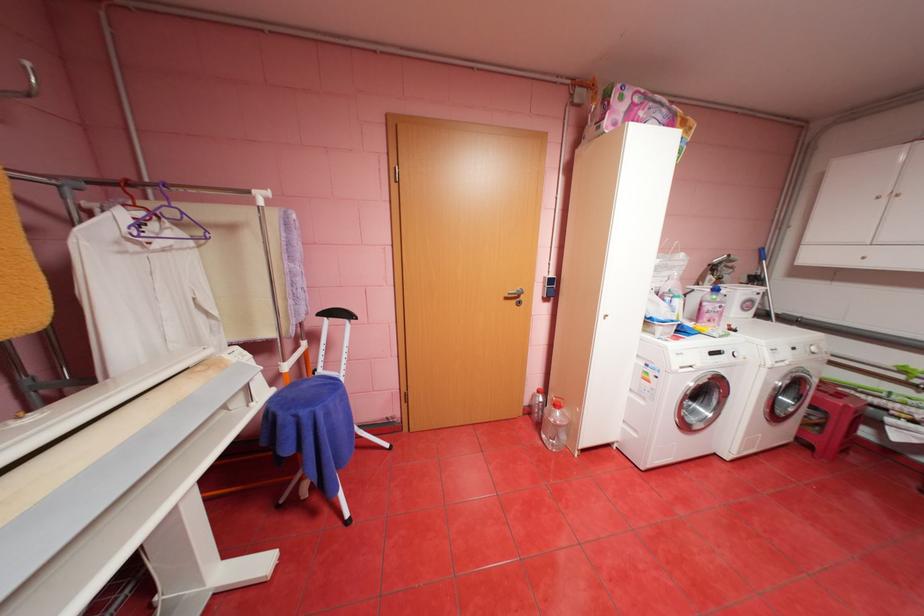
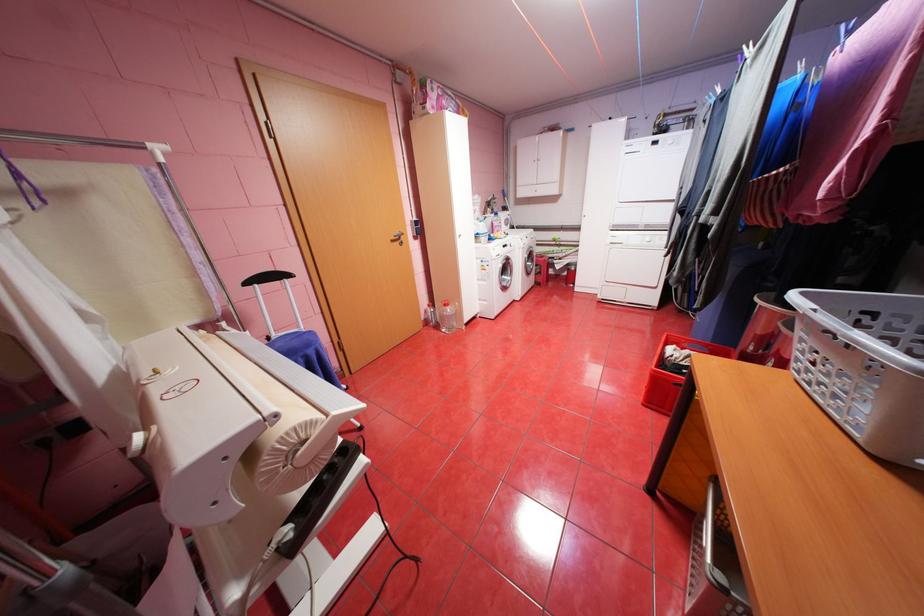
Question: The images are taken continuously from a first-person perspective. In which direction is your viewpoint rotating?

Choices:
 (A) Left
 (B) Right
 (C) Up
 (D) Down

Answer: (B)